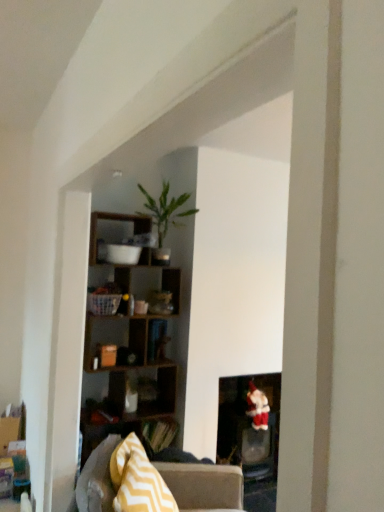
The width and height of the screenshot is (384, 512). Describe the element at coordinates (248, 425) in the screenshot. I see `matte black fireplace at lower right` at that location.

Measure the distance between gray fabric couch at center and camera.

gray fabric couch at center and camera are 7.35 feet apart.

In order to face green matte plant at upper center, should I rotate leftwards or rightwards?

You should rotate left by 3.603 degrees.

The height and width of the screenshot is (512, 384). What do you see at coordinates (165, 217) in the screenshot? I see `green matte plant at upper center` at bounding box center [165, 217].

Find the location of a particular element. matte black fireplace at lower right is located at coordinates (248, 425).

Which is behind, point (267, 415) or point (221, 390)?

Positioned behind is point (221, 390).

Consider the image. Considering the relative positions of velvet santa at lower right and matte black fireplace at lower right in the image provided, is velvet santa at lower right to the right of matte black fireplace at lower right from the viewer's perspective?

Correct, you'll find velvet santa at lower right to the right of matte black fireplace at lower right.

From the image's perspective, who appears lower, velvet santa at lower right or matte black fireplace at lower right?

matte black fireplace at lower right is shown below in the image.

Is velvet santa at lower right oriented towards matte black fireplace at lower right?

Yes, velvet santa at lower right is facing matte black fireplace at lower right.

Looking at this image, would you say wooden cube shelf at upper center is inside or outside matte black fireplace at lower right?

wooden cube shelf at upper center cannot be found inside matte black fireplace at lower right.

Would you consider wooden cube shelf at upper center to be distant from matte black fireplace at lower right?

They are positioned close to each other.

Find the location of a particular element. This screenshot has height=512, width=384. shelf above the matte black fireplace at lower right (from a real-world perspective) is located at coordinates (127, 336).

Does wooden cube shelf at upper center have a smaller size compared to matte black fireplace at lower right?

No, wooden cube shelf at upper center is not smaller than matte black fireplace at lower right.

Considering the relative positions of wooden cube shelf at upper center and velvet santa at lower right in the image provided, is wooden cube shelf at upper center to the right of velvet santa at lower right from the viewer's perspective?

Incorrect, wooden cube shelf at upper center is not on the right side of velvet santa at lower right.

Is point (138, 317) positioned before point (266, 407)?

Yes, it is.

Between wooden cube shelf at upper center and velvet santa at lower right, which one has larger size?

wooden cube shelf at upper center.

The width and height of the screenshot is (384, 512). I want to click on shelf located on the left of velvet santa at lower right, so click(x=127, y=336).

Which is behind, matte black fireplace at lower right or yellow zigzag fabric pillow at lower left?

matte black fireplace at lower right.

Identify the location of pillow located above the matte black fireplace at lower right (from the image's perspective). The width and height of the screenshot is (384, 512). (138, 480).

Considering the points (260, 382) and (116, 465), which point is behind, point (260, 382) or point (116, 465)?

Point (260, 382)

Considering the sizes of objects matte black fireplace at lower right and yellow zigzag fabric pillow at lower left in the image provided, who is bigger, matte black fireplace at lower right or yellow zigzag fabric pillow at lower left?

With larger size is matte black fireplace at lower right.

Is matte black fireplace at lower right thinner than velvet santa at lower right?

No, matte black fireplace at lower right is not thinner than velvet santa at lower right.

From the picture: Is matte black fireplace at lower right to the left or to the right of velvet santa at lower right in the image?

Based on their positions, matte black fireplace at lower right is located to the left of velvet santa at lower right.

From a real-world perspective, who is located lower, matte black fireplace at lower right or velvet santa at lower right?

From a 3D spatial view, matte black fireplace at lower right is below.

Is green matte plant at upper center touching yellow zigzag fabric pillow at lower left?

They are not placed beside each other.

Does green matte plant at upper center have a lesser height compared to yellow zigzag fabric pillow at lower left?

No, green matte plant at upper center is not shorter than yellow zigzag fabric pillow at lower left.

Which object is more forward, green matte plant at upper center or yellow zigzag fabric pillow at lower left?

yellow zigzag fabric pillow at lower left is closer to the camera.

Does green matte plant at upper center appear on the left side of yellow zigzag fabric pillow at lower left?

Incorrect, green matte plant at upper center is not on the left side of yellow zigzag fabric pillow at lower left.

Is gray fabric couch at center not near velvet santa at lower right?

No, gray fabric couch at center is not far away from velvet santa at lower right.

In the scene shown: Is gray fabric couch at center turned away from velvet santa at lower right?

gray fabric couch at center is not turned away from velvet santa at lower right.

Can we say gray fabric couch at center lies outside velvet santa at lower right?

Yes, gray fabric couch at center is located beyond the bounds of velvet santa at lower right.

Locate an element on the screen. The height and width of the screenshot is (512, 384). studio couch located on the left of velvet santa at lower right is located at coordinates (204, 486).

Locate an element on the screen. The height and width of the screenshot is (512, 384). fireplace below the velvet santa at lower right (from a real-world perspective) is located at coordinates (248, 425).

This screenshot has width=384, height=512. I want to click on fireplace below the wooden cube shelf at upper center (from the image's perspective), so click(248, 425).

Looking at the image, which one is located closer to yellow zigzag fabric pillow at lower left, velvet santa at lower right or gray fabric couch at center?

gray fabric couch at center is closer to yellow zigzag fabric pillow at lower left.

Which object lies nearer to the anchor point matte black fireplace at lower right, wooden cube shelf at upper center or velvet santa at lower right?

velvet santa at lower right.

Which object lies nearer to the anchor point gray fabric couch at center, wooden cube shelf at upper center or velvet santa at lower right?

The object closer to gray fabric couch at center is wooden cube shelf at upper center.

From the picture: When comparing their distances from wooden cube shelf at upper center, does gray fabric couch at center or yellow zigzag fabric pillow at lower left seem further?

Among the two, yellow zigzag fabric pillow at lower left is located further to wooden cube shelf at upper center.

Which object lies further to the anchor point yellow zigzag fabric pillow at lower left, velvet santa at lower right or matte black fireplace at lower right?

velvet santa at lower right.

When comparing their distances from wooden cube shelf at upper center, does velvet santa at lower right or gray fabric couch at center seem further?

Based on the image, velvet santa at lower right appears to be further to wooden cube shelf at upper center.

Based on their spatial positions, is yellow zigzag fabric pillow at lower left or velvet santa at lower right closer to gray fabric couch at center?

Among the two, yellow zigzag fabric pillow at lower left is located nearer to gray fabric couch at center.

Looking at the image, which one is located further to gray fabric couch at center, yellow zigzag fabric pillow at lower left or green matte plant at upper center?

green matte plant at upper center is positioned further to the anchor gray fabric couch at center.

Locate an element on the screen. The height and width of the screenshot is (512, 384). studio couch between green matte plant at upper center and matte black fireplace at lower right vertically is located at coordinates (204, 486).

Identify the location of shelf between yellow zigzag fabric pillow at lower left and velvet santa at lower right from front to back. Image resolution: width=384 pixels, height=512 pixels. (127, 336).

The height and width of the screenshot is (512, 384). I want to click on shelf positioned between yellow zigzag fabric pillow at lower left and matte black fireplace at lower right from near to far, so click(127, 336).

The image size is (384, 512). Find the location of `shelf between green matte plant at upper center and matte black fireplace at lower right vertically`. shelf between green matte plant at upper center and matte black fireplace at lower right vertically is located at coordinates (127, 336).